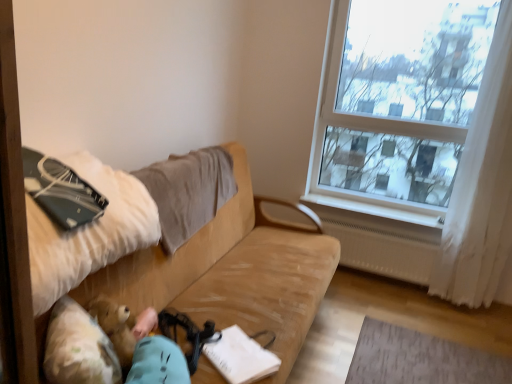
This screenshot has width=512, height=384. I want to click on white sheer curtain at right, so click(x=481, y=187).

The height and width of the screenshot is (384, 512). What are the coordinates of `white plastic radiator at lower right` in the screenshot? It's located at (375, 218).

The image size is (512, 384). I want to click on beige fabric couch at center, so click(x=232, y=273).

What are the coordinates of `beige fabric pillow at upper left` in the screenshot? It's located at (188, 191).

The image size is (512, 384). Describe the element at coordinates (380, 132) in the screenshot. I see `transparent glass window at upper right` at that location.

In order to face matte black notebook at left, should I rotate leftwards or rightwards?

You should rotate left by 26.725 degrees.

What do you see at coordinates (61, 191) in the screenshot? This screenshot has width=512, height=384. I see `matte black notebook at left` at bounding box center [61, 191].

What do you see at coordinates (78, 348) in the screenshot?
I see `fluffy beige teddy bear at lower left` at bounding box center [78, 348].

Find the location of a particular element. The height and width of the screenshot is (384, 512). white paper at center is located at coordinates (240, 357).

Is beige fabric pillow at upper left a part of white plastic radiator at lower right?

No, beige fabric pillow at upper left is not inside white plastic radiator at lower right.

Is white plastic radiator at lower right further to the viewer compared to beige fabric pillow at upper left?

Yes, white plastic radiator at lower right is further from the camera.

Consider the image. Is white plastic radiator at lower right with beige fabric pillow at upper left?

white plastic radiator at lower right and beige fabric pillow at upper left are not in contact.

Considering the points (392, 224) and (214, 210), which point is in front, point (392, 224) or point (214, 210)?

The point (214, 210) is more forward.

Consider the image. From a real-world perspective, between white paper at center and fluffy beige teddy bear at lower left, who is vertically higher?

fluffy beige teddy bear at lower left.

From the image's perspective, is white paper at center positioned above or below fluffy beige teddy bear at lower left?

Clearly, from the image's perspective, white paper at center is below fluffy beige teddy bear at lower left.

Does white paper at center touch fluffy beige teddy bear at lower left?

There is a gap between white paper at center and fluffy beige teddy bear at lower left.

Considering the positions of objects white paper at center and fluffy beige teddy bear at lower left in the image provided, who is more to the left, white paper at center or fluffy beige teddy bear at lower left?

fluffy beige teddy bear at lower left.

Considering their positions, is white paper at center located in front of or behind white plastic radiator at lower right?

Clearly, white paper at center is in front of white plastic radiator at lower right.

Would you say white paper at center contains white plastic radiator at lower right?

Actually, white plastic radiator at lower right is outside white paper at center.

From a real-world perspective, between white paper at center and white plastic radiator at lower right, who is vertically higher?

In real-world perspective, white plastic radiator at lower right is above.

Is matte black notebook at left at the back of beige fabric couch at center?

beige fabric couch at center is not turned away from matte black notebook at left.

Can you tell me how much beige fabric couch at center and matte black notebook at left differ in facing direction?

They differ by 6.92 degrees in their facing directions.

Is beige fabric couch at center positioned beyond the bounds of matte black notebook at left?

Yes, beige fabric couch at center is outside of matte black notebook at left.

Who is taller, beige fabric couch at center or matte black notebook at left?

beige fabric couch at center.

Considering the sizes of objects beige fabric couch at center and white plastic radiator at lower right in the image provided, who is taller, beige fabric couch at center or white plastic radiator at lower right?

Standing taller between the two is beige fabric couch at center.

Based on the photo, is there a large distance between beige fabric couch at center and white plastic radiator at lower right?

No, there isn't a large distance between beige fabric couch at center and white plastic radiator at lower right.

Can you confirm if beige fabric couch at center is positioned to the left of white plastic radiator at lower right?

Correct, you'll find beige fabric couch at center to the left of white plastic radiator at lower right.

Would you say transparent glass window at upper right is a long distance from white sheer curtain at right?

Actually, transparent glass window at upper right and white sheer curtain at right are a little close together.

Is transparent glass window at upper right behind white sheer curtain at right?

Yes.

Between transparent glass window at upper right and white sheer curtain at right, which one has smaller size?

white sheer curtain at right.

Does point (440, 120) appear closer or farther from the camera than point (459, 262)?

Point (440, 120) is farther from the camera than point (459, 262).

Between matte black notebook at left and transparent glass window at upper right, which one has smaller width?

transparent glass window at upper right is thinner.

Is matte black notebook at left oriented towards transparent glass window at upper right?

No, matte black notebook at left is not turned towards transparent glass window at upper right.

Locate an element on the screen. window that appears above the matte black notebook at left (from the image's perspective) is located at coordinates (380, 132).

From a real-world perspective, is matte black notebook at left on top of transparent glass window at upper right?

No.

The image size is (512, 384). In the image, there is a beige fabric pillow at upper left. Find the location of `window sill below it (from the image's perspective)`. window sill below it (from the image's perspective) is located at coordinates (375, 218).

Where is `animal above the white paper at center (from a real-world perspective)`? animal above the white paper at center (from a real-world perspective) is located at coordinates (78, 348).

From the image, which object appears to be farther from beige fabric pillow at upper left, white paper at center or white sheer curtain at right?

white sheer curtain at right.

Which object lies further to the anchor point white plastic radiator at lower right, matte black notebook at left or beige fabric pillow at upper left?

Among the two, matte black notebook at left is located further to white plastic radiator at lower right.

Based on their spatial positions, is transparent glass window at upper right or white sheer curtain at right closer to white paper at center?

white sheer curtain at right lies closer to white paper at center than the other object.

From the image, which object appears to be farther from white paper at center, fluffy beige teddy bear at lower left or transparent glass window at upper right?

transparent glass window at upper right is further to white paper at center.

From the image, which object appears to be nearer to fluffy beige teddy bear at lower left, white paper at center or beige fabric pillow at upper left?

white paper at center is closer to fluffy beige teddy bear at lower left.

Which object lies nearer to the anchor point fluffy beige teddy bear at lower left, beige fabric pillow at upper left or white paper at center?

white paper at center is closer to fluffy beige teddy bear at lower left.

Considering their positions, is beige fabric pillow at upper left positioned further to beige fabric couch at center than matte black notebook at left?

Based on the image, matte black notebook at left appears to be further to beige fabric couch at center.

Which object lies nearer to the anchor point matte black notebook at left, white paper at center or white plastic radiator at lower right?

Based on the image, white paper at center appears to be nearer to matte black notebook at left.

You are a GUI agent. You are given a task and a screenshot of the screen. Output one action in this format:
    pyautogui.click(x=<x>, y=<y>)
    Task: Click on the studio couch between matte black notebook at left and white sheer curtain at right in the horizontal direction
    Image resolution: width=512 pixels, height=384 pixels.
    Given the screenshot: What is the action you would take?
    pyautogui.click(x=232, y=273)

The image size is (512, 384). In order to click on animal between matte black notebook at left and white sheer curtain at right in the horizontal direction in this screenshot , I will do `click(78, 348)`.

Find the location of a particular element. The image size is (512, 384). animal between matte black notebook at left and white paper at center in the up-down direction is located at coordinates (78, 348).

The width and height of the screenshot is (512, 384). I want to click on studio couch between beige fabric pillow at upper left and white sheer curtain at right from left to right, so click(x=232, y=273).